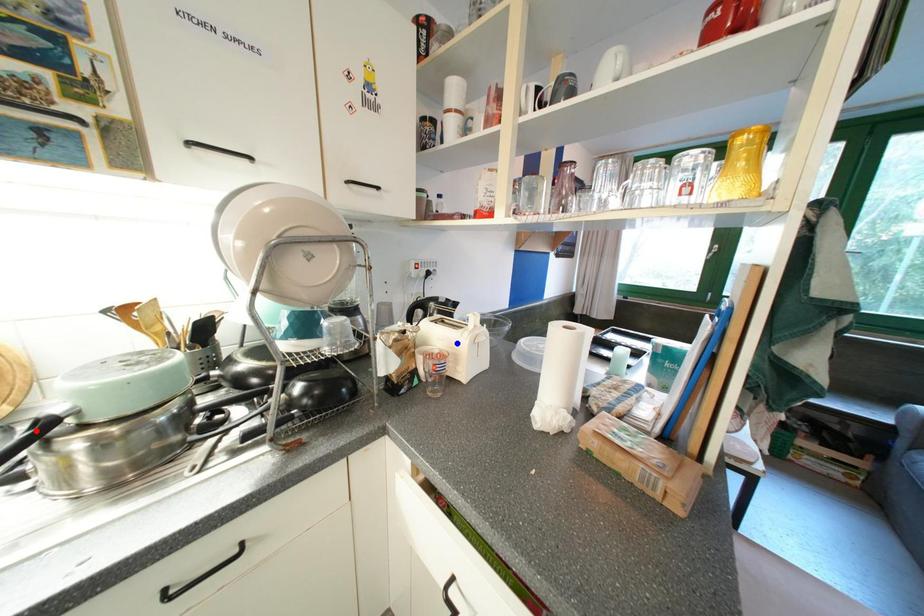
Question: Two points are marked on the image. Which point is closer to the camera?

Choices:
 (A) Blue point is closer.
 (B) Red point is closer.

Answer: (B)